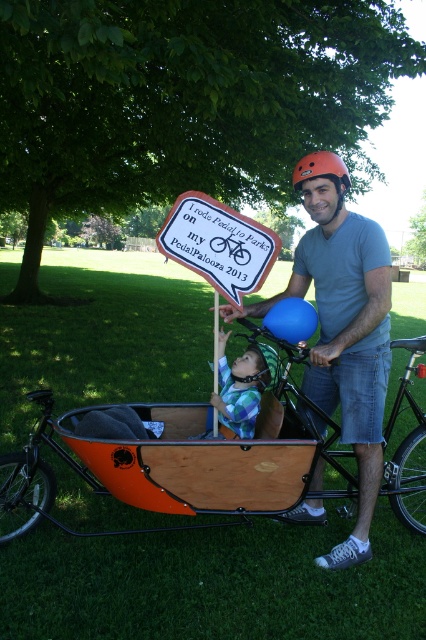
Is checkered fabric baby at center closer to camera compared to orange matte helmet at upper center?

No, it is not.

In order to click on checkered fabric baby at center in this screenshot , I will do `click(242, 387)`.

Is point (247, 388) farther from viewer compared to point (331, 161)?

Yes, point (247, 388) is behind point (331, 161).

Image resolution: width=426 pixels, height=640 pixels. What are the coordinates of `checkered fabric baby at center` in the screenshot? It's located at (242, 387).

Between matte gray helmet at upper center and orange matte helmet at upper center, which one has less height?

With less height is orange matte helmet at upper center.

Is point (365, 477) positioned behind point (319, 166)?

Yes.

The height and width of the screenshot is (640, 426). I want to click on matte gray helmet at upper center, so click(x=342, y=326).

Is matte gray helmet at upper center below checkered fabric baby at center?

No.

In the scene shown: Is matte gray helmet at upper center shorter than checkered fabric baby at center?

No, matte gray helmet at upper center is not shorter than checkered fabric baby at center.

Who is more distant from viewer, (325, 244) or (268, 384)?

The point (268, 384) is behind.

Find the location of a particular element. The height and width of the screenshot is (640, 426). matte gray helmet at upper center is located at coordinates (342, 326).